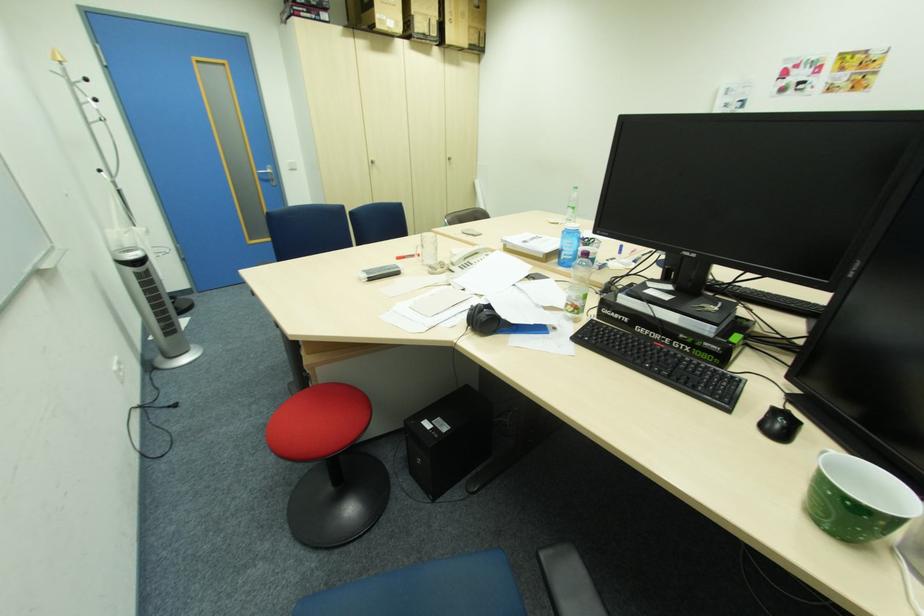
The location [499,321] corresponds to which object?

This point indicates the black headphones.